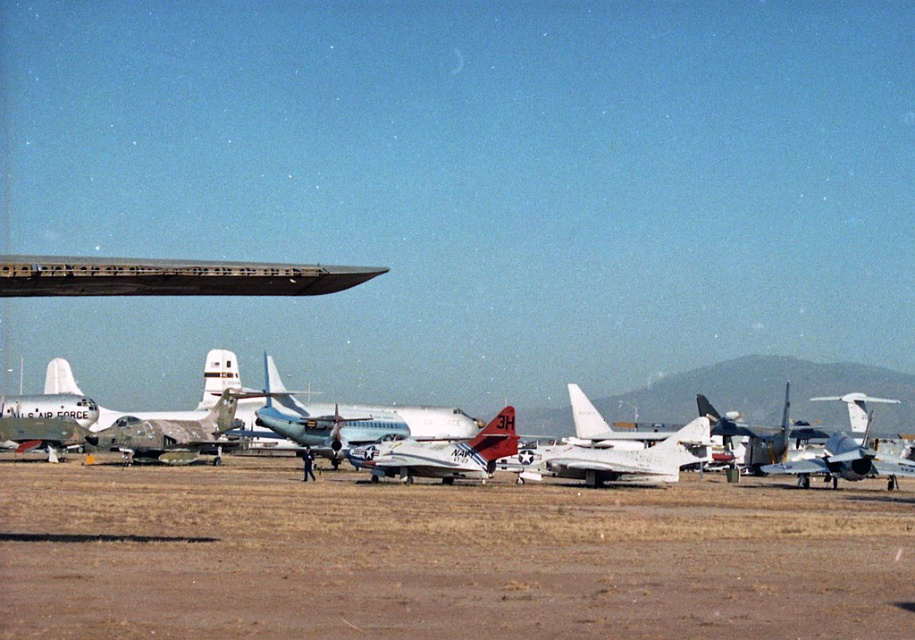
Question: Does brown dirt field at center have a smaller size compared to silver metallic airplane at center?

Choices:
 (A) no
 (B) yes

Answer: (B)

Question: Among these objects, which one is nearest to the camera?

Choices:
 (A) silver metallic airplane at center
 (B) brown dirt field at center

Answer: (B)

Question: Which point is farther from the camera taking this photo?

Choices:
 (A) click(82, 472)
 (B) click(902, 408)

Answer: (B)

Question: Can you confirm if brown dirt field at center is wider than silver metallic airplane at center?

Choices:
 (A) yes
 (B) no

Answer: (B)

Question: Does brown dirt field at center appear on the left side of silver metallic airplane at center?

Choices:
 (A) yes
 (B) no

Answer: (A)